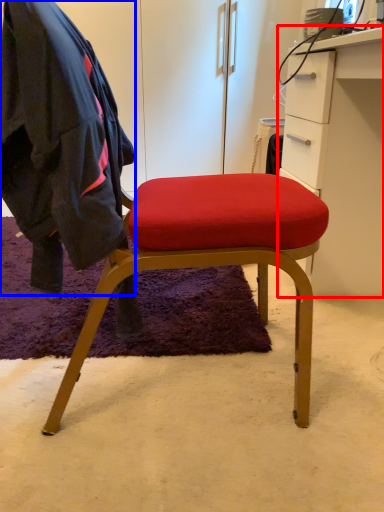
Question: Which of the following is the farthest to the observer, cabinetry (highlighted by a red box) or clothing (highlighted by a blue box)?

Choices:
 (A) cabinetry
 (B) clothing

Answer: (A)